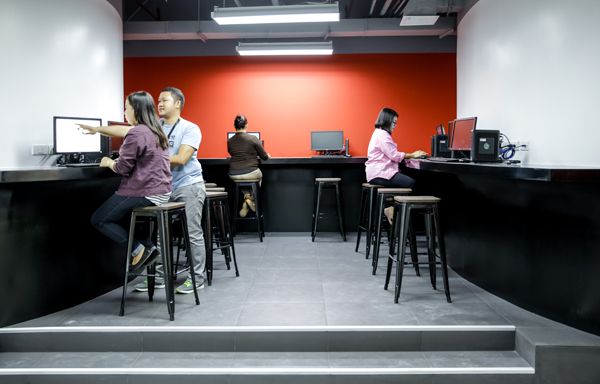
Find the location of a particular element. The height and width of the screenshot is (384, 600). light fixtures is located at coordinates (313, 5), (310, 52).